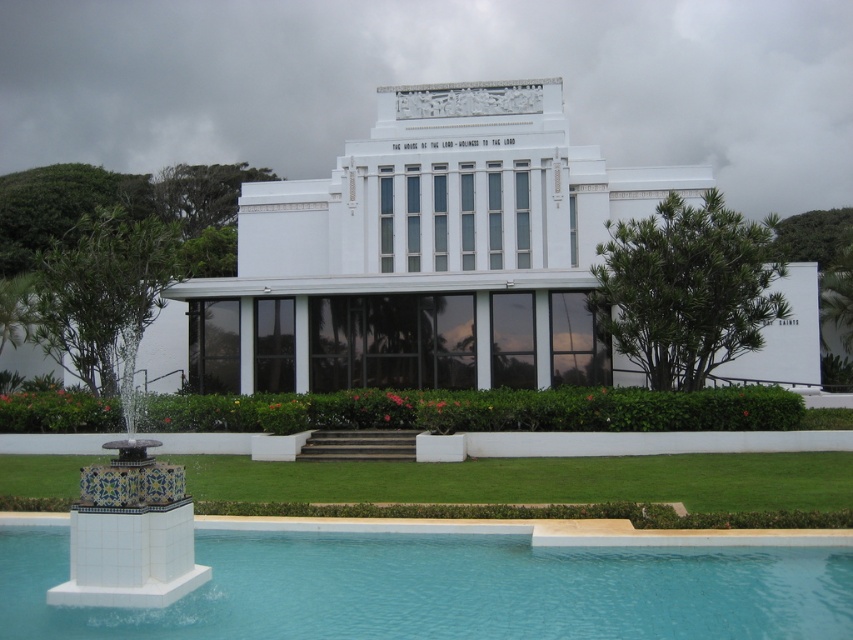
Which is behind, point (379, 634) or point (33, 337)?

Point (33, 337)

Is point (67, 568) farther from viewer compared to point (119, 337)?

No, (67, 568) is in front of (119, 337).

You are a GUI agent. You are given a task and a screenshot of the screen. Output one action in this format:
    pyautogui.click(x=<x>, y=<y>)
    Task: Click on the blue glossy water at lower center
    
    Given the screenshot: What is the action you would take?
    pyautogui.click(x=445, y=588)

Who is positioned more to the left, blue glossy water at lower center or green leafy tree at upper left?

From the viewer's perspective, green leafy tree at upper left appears more on the left side.

Is blue glossy water at lower center closer to the viewer compared to green leafy tree at upper left?

That is True.

Is point (289, 609) closer to camera compared to point (119, 202)?

Yes, it is.

The height and width of the screenshot is (640, 853). What are the coordinates of `blue glossy water at lower center` in the screenshot? It's located at (445, 588).

Who is more distant from viewer, [96,275] or [12,248]?

The point [12,248] is more distant.

Does blue tile fountain at lower left appear on the right side of green leafy tree at upper left?

Correct, you'll find blue tile fountain at lower left to the right of green leafy tree at upper left.

Describe the element at coordinates (125, 420) in the screenshot. I see `blue tile fountain at lower left` at that location.

This screenshot has height=640, width=853. I want to click on blue tile fountain at lower left, so click(125, 420).